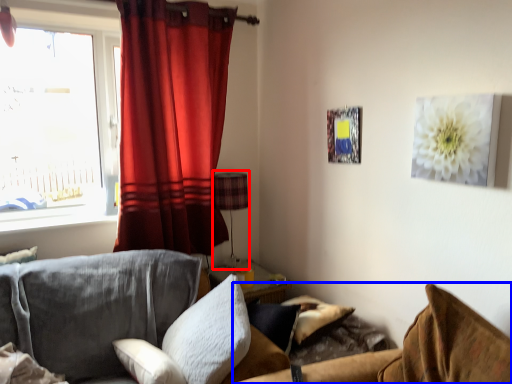
Question: Among these objects, which one is farthest to the camera, lamp (highlighted by a red box) or couch (highlighted by a blue box)?

Choices:
 (A) lamp
 (B) couch

Answer: (A)